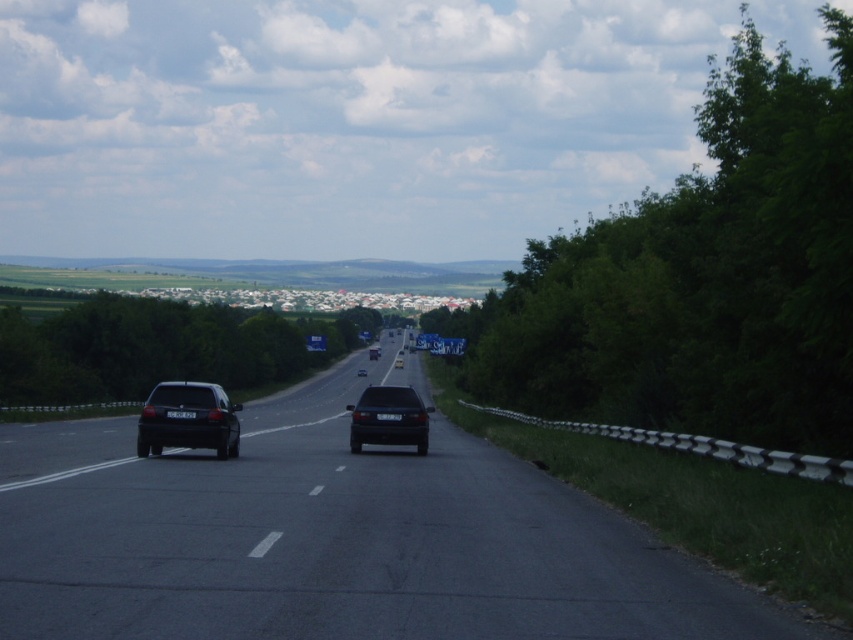
Question: Does satin black sedan at left appear on the left side of satin black sedan at center?

Choices:
 (A) no
 (B) yes

Answer: (B)

Question: Among these points, which one is farthest from the camera?

Choices:
 (A) (366, 392)
 (B) (51, 500)
 (C) (189, 422)

Answer: (A)

Question: Is satin black sedan at left positioned before satin black sedan at center?

Choices:
 (A) no
 (B) yes

Answer: (B)

Question: Which of the following is the closest to the observer?

Choices:
 (A) satin black sedan at center
 (B) black asphalt highway at center
 (C) satin black sedan at left

Answer: (B)

Question: Is satin black sedan at left behind satin black sedan at center?

Choices:
 (A) yes
 (B) no

Answer: (B)

Question: Which point is closer to the camera taking this photo?

Choices:
 (A) (213, 426)
 (B) (358, 436)

Answer: (A)